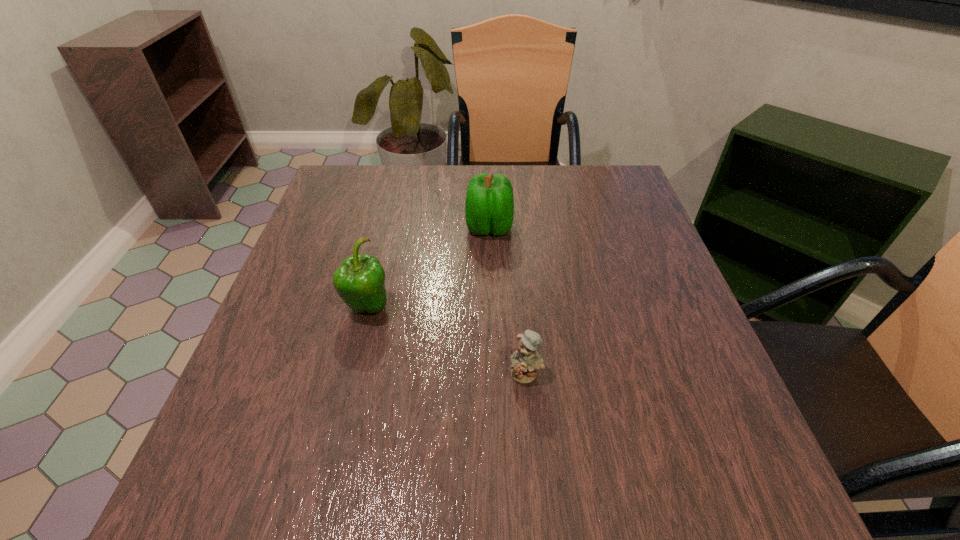
Locate an element on the screen. free space that satisfies the following two spatial constraints: 1. on the back side of the right bell pepper; 2. on the left side of the second nearest object is located at coordinates (387, 227).

I want to click on free point that satisfies the following two spatial constraints: 1. on the back side of the farthest object; 2. on the right side of the left bell pepper, so click(387, 227).